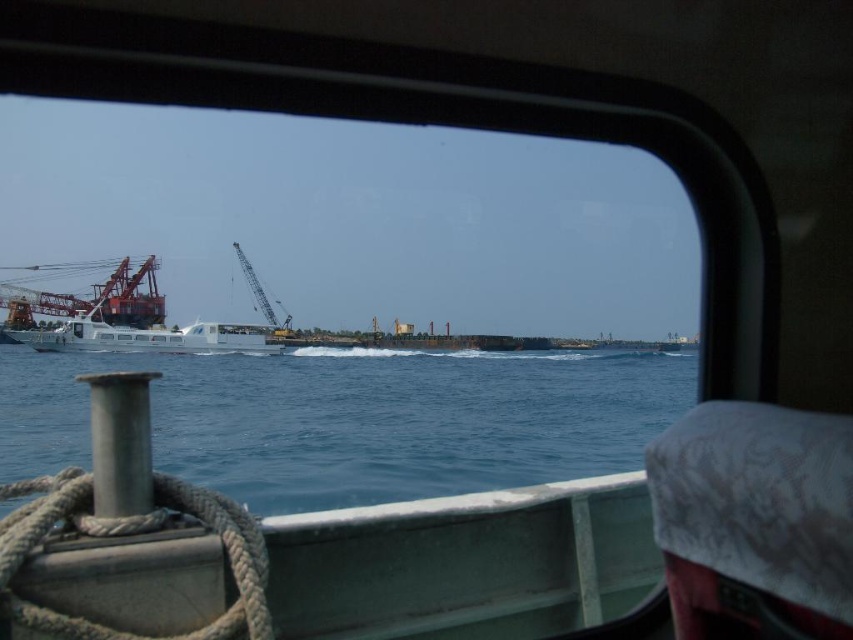
Question: Which object is the farthest from the white matte rope at lower left?

Choices:
 (A) white glossy boat at left
 (B) orange metallic crane at left

Answer: (B)

Question: Which object is positioned closest to the white matte rope at lower left?

Choices:
 (A) orange metallic crane at left
 (B) white glossy boat at left
 (C) blue water at center

Answer: (C)

Question: Which object is farther from the camera taking this photo?

Choices:
 (A) white matte rope at lower left
 (B) white glossy boat at left
 (C) blue water at center

Answer: (B)

Question: Does white matte rope at lower left have a lesser width compared to orange metallic crane at left?

Choices:
 (A) no
 (B) yes

Answer: (B)

Question: Does white matte rope at lower left lie behind white glossy boat at left?

Choices:
 (A) yes
 (B) no

Answer: (B)

Question: Does blue water at center appear over white glossy boat at left?

Choices:
 (A) yes
 (B) no

Answer: (B)